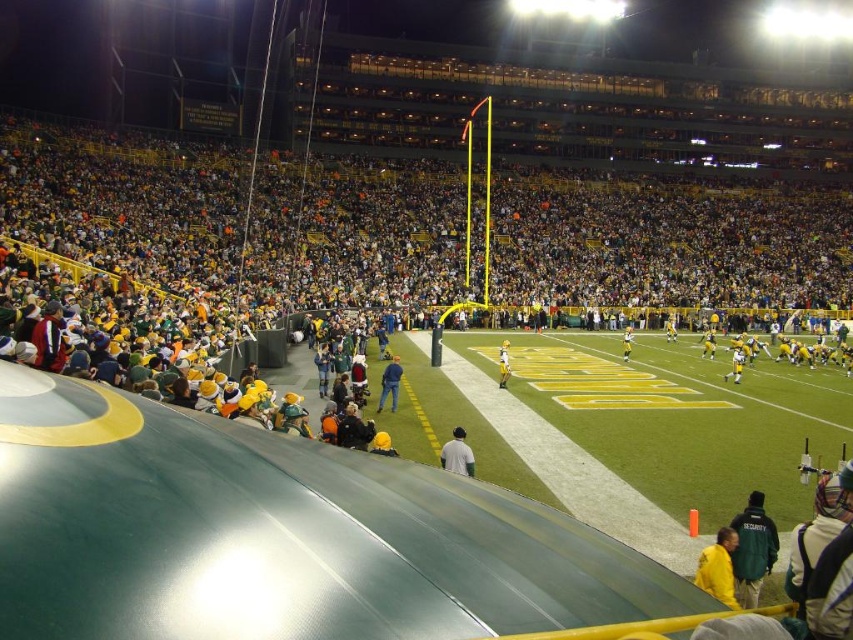
Question: Which of the following is the closest to the observer?

Choices:
 (A) (462, 460)
 (B) (738, 358)

Answer: (A)

Question: Which object is positioned closest to the yellow uniform at center?

Choices:
 (A) gray fabric jacket at lower center
 (B) yellow matte helmet at center

Answer: (B)

Question: Does green matte security jacket at lower right appear on the left side of yellow uniform at center?

Choices:
 (A) yes
 (B) no

Answer: (A)

Question: Does yellow matte jacket at lower right have a smaller size compared to white jersey at center?

Choices:
 (A) no
 (B) yes

Answer: (B)

Question: Can you confirm if green matte security jacket at lower right is positioned below white jersey at center?

Choices:
 (A) no
 (B) yes

Answer: (B)

Question: Among these points, which one is nearest to the camera?

Choices:
 (A) (753, 564)
 (B) (625, 349)
 (C) (712, 353)

Answer: (A)